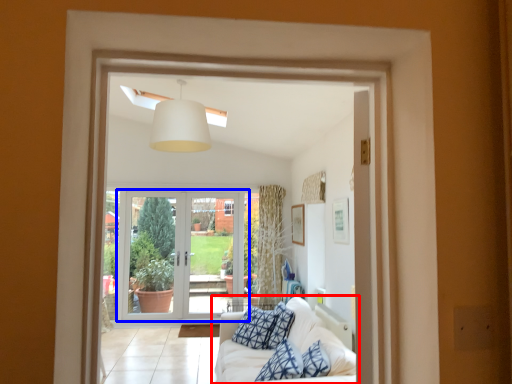
Question: Among these objects, which one is nearest to the camera, studio couch (highlighted by a red box) or door (highlighted by a blue box)?

Choices:
 (A) studio couch
 (B) door

Answer: (A)